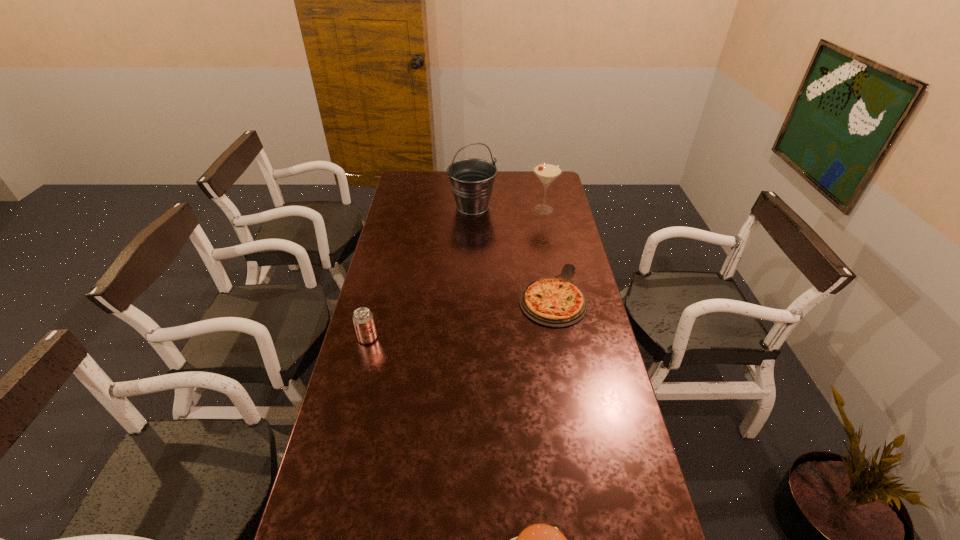
Locate an element on the screen. Image resolution: width=960 pixels, height=540 pixels. object present at the far edge is located at coordinates (472, 180).

This screenshot has height=540, width=960. In order to click on object that is at the left edge in this screenshot , I will do `click(363, 320)`.

Find the location of a particular element. The width and height of the screenshot is (960, 540). martini at the right edge is located at coordinates (547, 172).

Image resolution: width=960 pixels, height=540 pixels. What are the coordinates of `pizza at the right edge` in the screenshot? It's located at (556, 302).

This screenshot has height=540, width=960. Find the location of `vacant space at the far edge`. vacant space at the far edge is located at coordinates (448, 185).

The height and width of the screenshot is (540, 960). I want to click on free region at the left edge of the desktop, so click(392, 278).

I want to click on vacant space at the right edge of the desktop, so click(x=590, y=396).

Find the location of `free point between the bucket and the martini`. free point between the bucket and the martini is located at coordinates (508, 208).

Where is `vacant area that lies between the beer can and the pizza`? This screenshot has height=540, width=960. vacant area that lies between the beer can and the pizza is located at coordinates (460, 316).

Find the location of a particular element. Image resolution: width=960 pixels, height=540 pixels. vacant region between the pizza and the tallest object is located at coordinates (513, 251).